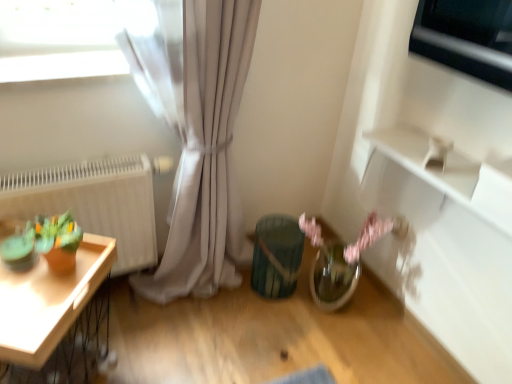
Locate an element on the screen. vacant space to the right of wooden tray at left is located at coordinates (176, 348).